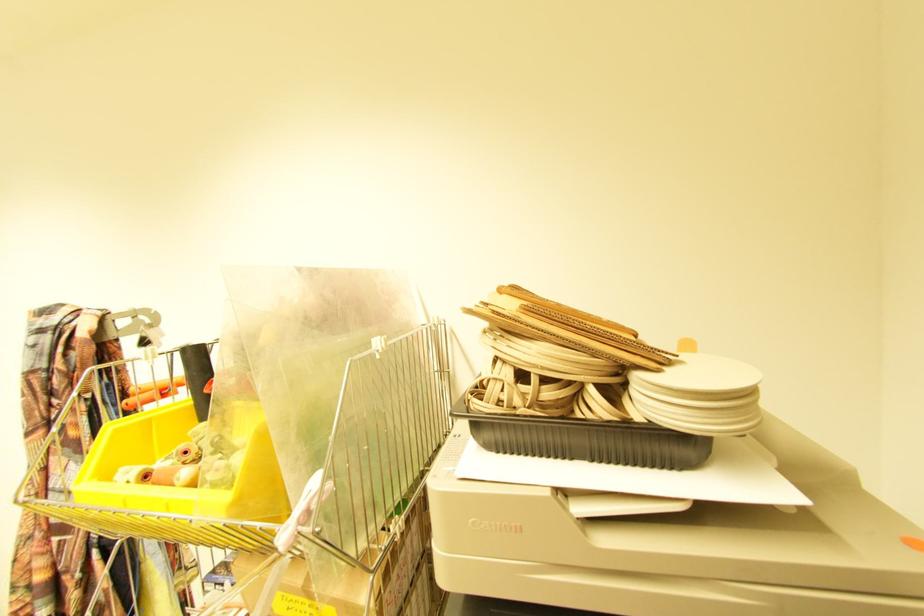
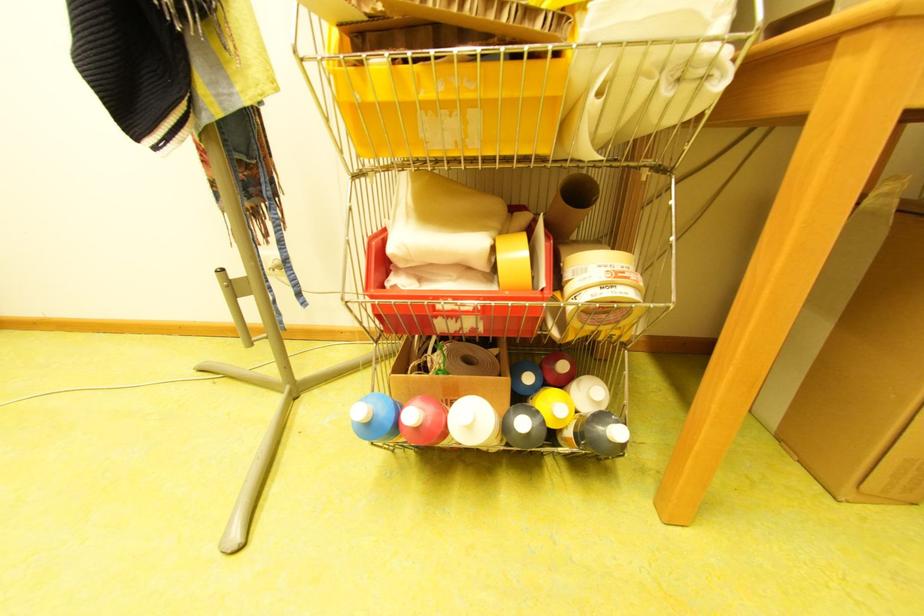
Question: What movement of the cameraman would produce the second image?

Choices:
 (A) Left
 (B) Right
 (C) Forward
 (D) Backward

Answer: (A)